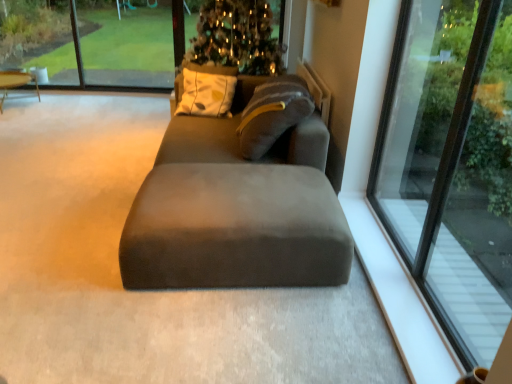
Where is `vacant space in matte brown table at left (from a real-world perspective)`? Image resolution: width=512 pixels, height=384 pixels. vacant space in matte brown table at left (from a real-world perspective) is located at coordinates (18, 101).